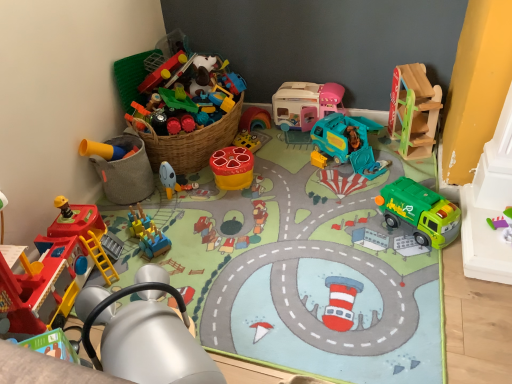
Identify the location of free location to the right of matte plastic toy at center, which is the 3th toy in left-to-right order. (215, 195).